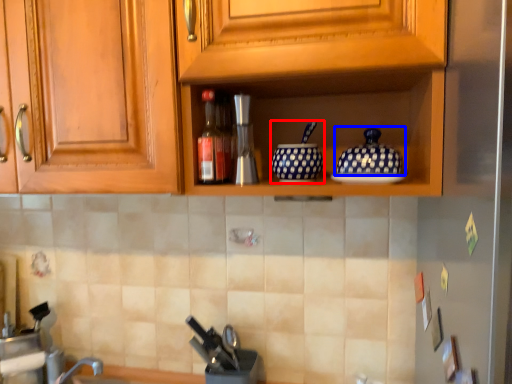
Question: Which object is closer to the camera taking this photo, tableware (highlighted by a red box) or pottery (highlighted by a blue box)?

Choices:
 (A) tableware
 (B) pottery

Answer: (B)